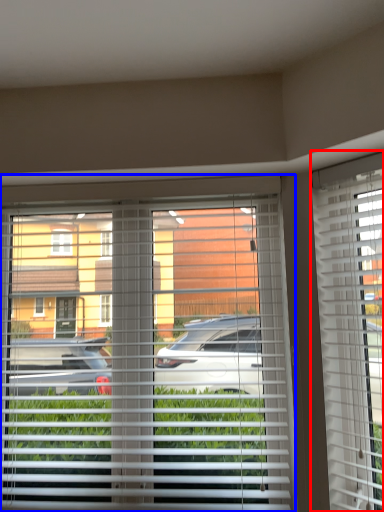
Question: Which object is closer to the camera taking this photo, window blind (highlighted by a red box) or window blind (highlighted by a blue box)?

Choices:
 (A) window blind
 (B) window blind

Answer: (A)